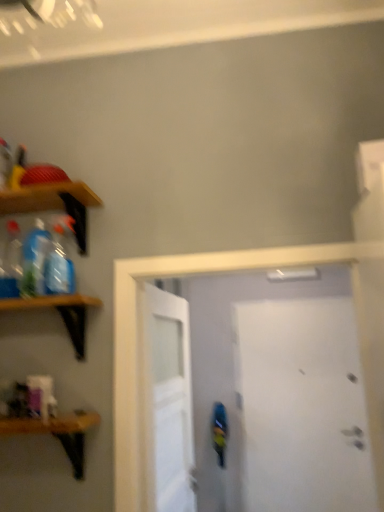
Question: Is translucent plastic bottle at left, the 1th bottle positioned from the left, bigger or smaller than white matte door at center, which is the second door in front-to-back order?

Choices:
 (A) big
 (B) small

Answer: (B)

Question: From their relative heights in the image, would you say translucent plastic bottle at left, which is the 3th bottle from right to left, is taller or shorter than white matte door at center, marked as the 2th door in a back-to-front arrangement?

Choices:
 (A) tall
 (B) short

Answer: (B)

Question: Considering the real-world distances, which object is closest to the white matte door at center, the 1th door viewed from the front?

Choices:
 (A) white matte door at right, which is the 1th door in back-to-front order
 (B) translucent plastic bottle at left, the 1th bottle positioned from the left
 (C) wooden shelf at left, which ranks as the first shelf in top-to-bottom order
 (D) white matte door at center, marked as the 2th door in a back-to-front arrangement
 (E) translucent plastic bottle at left, which is the 2th bottle in left-to-right order

Answer: (A)

Question: Estimate the real-world distances between objects in this image. Which object is closer to the wooden shelf at left, which is the 2th shelf in bottom-to-top order?

Choices:
 (A) wooden shelf at left, which ranks as the first shelf in top-to-bottom order
 (B) white matte door at center, which appears as the 3th door when viewed from the back
 (C) translucent plastic bottle at left, the 2th bottle when ordered from right to left
 (D) white matte door at right, which is the 1th door in back-to-front order
 (E) wooden shelf at lower left, placed as the first shelf when sorted from bottom to top

Answer: (C)